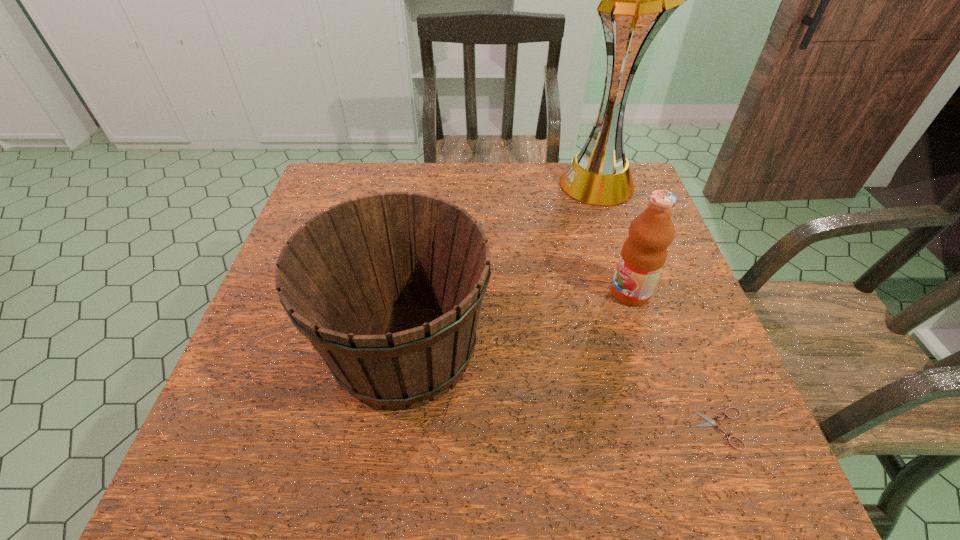
What are the coordinates of `vacant point located between the wine bucket and the trophy` in the screenshot? It's located at (502, 266).

Where is `vacant area between the fruit juice and the farthest object`? vacant area between the fruit juice and the farthest object is located at coordinates (614, 238).

The width and height of the screenshot is (960, 540). Identify the location of free space between the fruit juice and the tallest object. (614, 238).

Identify the location of vacant region between the farthest object and the wine bucket. (502, 266).

Locate an element on the screen. vacant area that lies between the leftmost object and the trophy is located at coordinates (502, 266).

I want to click on vacant space that is in between the leftmost object and the farthest object, so click(502, 266).

The height and width of the screenshot is (540, 960). Identify the location of object that is the second closest to the wine bucket. (710, 422).

You are a GUI agent. You are given a task and a screenshot of the screen. Output one action in this format:
    pyautogui.click(x=<x>, y=<y>)
    Task: Click on the object that stands as the third closest to the shortest object
    The image size is (960, 540).
    Given the screenshot: What is the action you would take?
    pyautogui.click(x=636, y=0)

Where is `vacant point that satisfies the following two spatial constraints: 1. on the front-facing side of the trophy; 2. on the right side of the shortest object`? This screenshot has width=960, height=540. vacant point that satisfies the following two spatial constraints: 1. on the front-facing side of the trophy; 2. on the right side of the shortest object is located at coordinates (679, 428).

Identify the location of vacant space that satisfies the following two spatial constraints: 1. on the front-facing side of the shears; 2. on the right side of the tallest object. (679, 428).